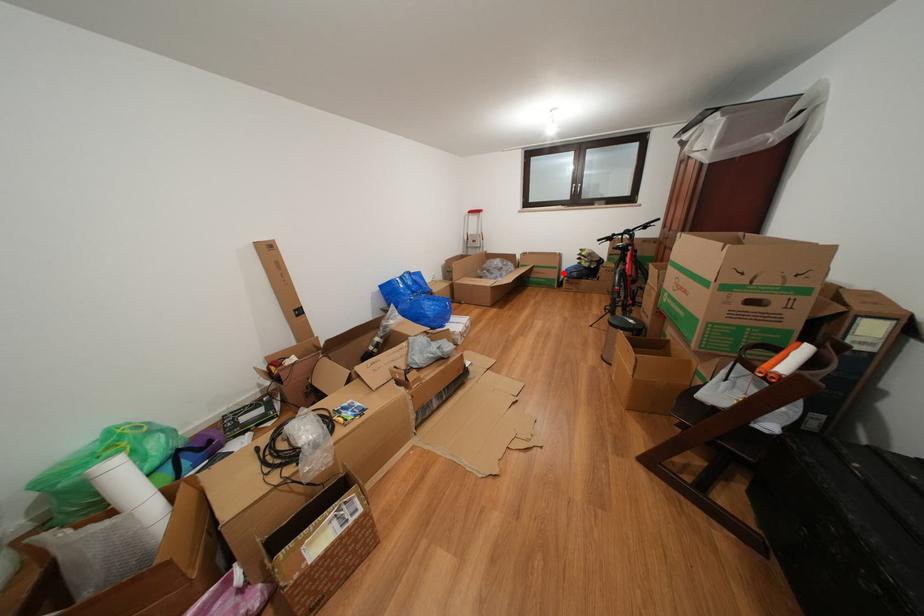
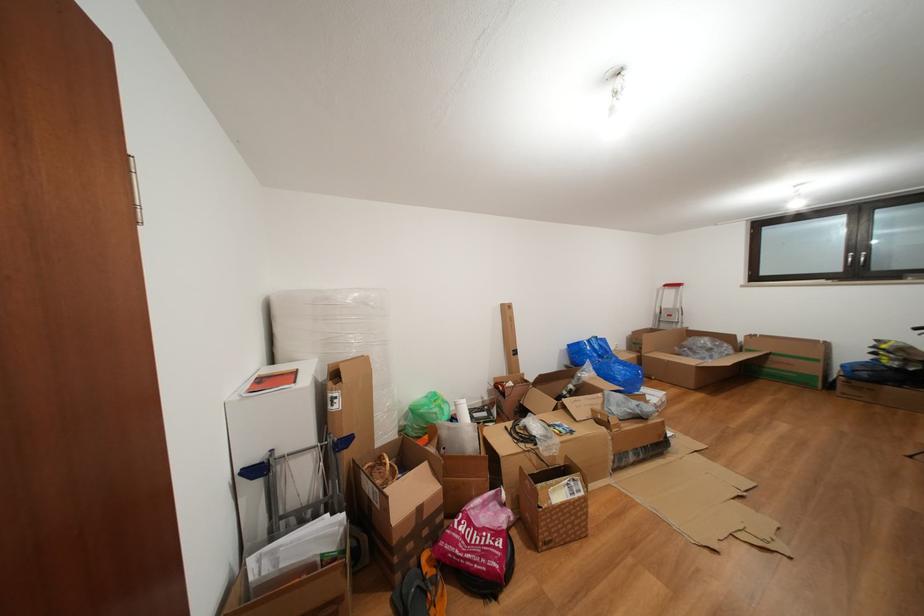
Question: I am providing you with two images of the same scene from different viewpoints. In image1, a red point is highlighted. Considering the same 3D point in image2, which of the following is correct?

Choices:
 (A) It is closer
 (B) It is farther

Answer: (B)